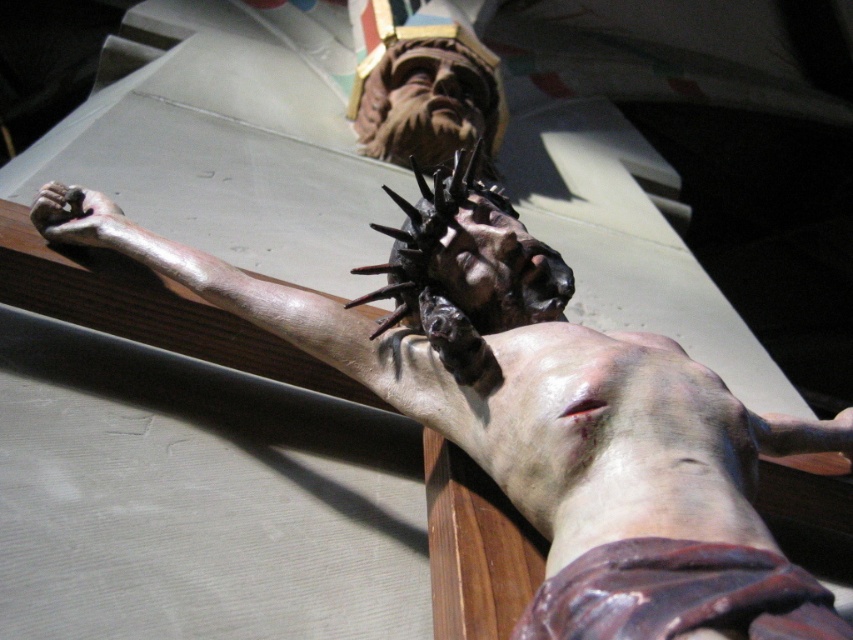
You are an art conservator examining the crucifix. You need to determine if the matte brown statue at center can fit through a narrow doorway that is the same width as the matte brown hand at lower left. Based on their widths, can the statue pass through the doorway?

The matte brown statue at center might be wider than matte brown hand at lower left, so it is uncertain if it can pass through the doorway. Further measurements are needed to confirm.